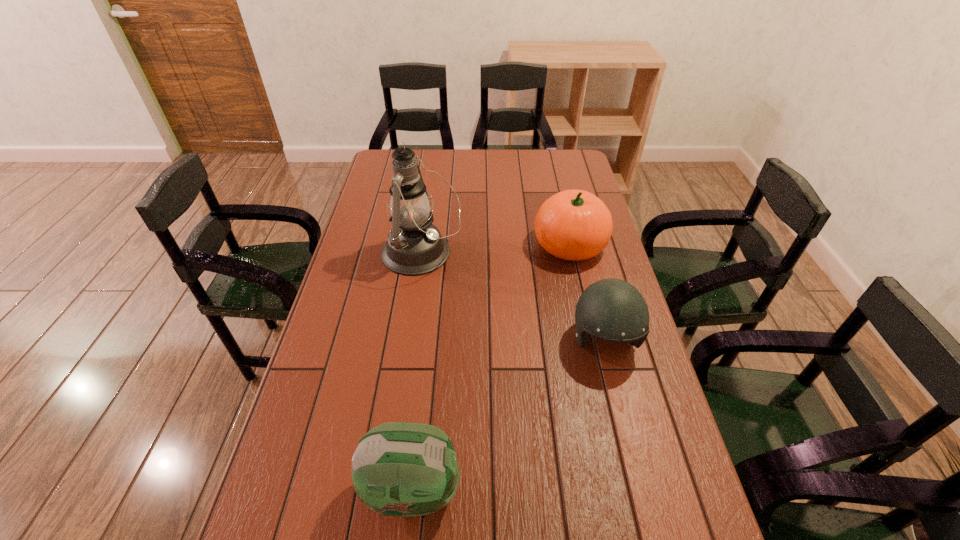
Locate an element on the screen. object that is at the left edge is located at coordinates (414, 246).

Locate an element on the screen. The image size is (960, 540). pumpkin located in the right edge section of the desktop is located at coordinates (573, 224).

You are a GUI agent. You are given a task and a screenshot of the screen. Output one action in this format:
    pyautogui.click(x=<x>, y=<y>)
    Task: Click on the football helmet that is at the right edge
    Image resolution: width=960 pixels, height=540 pixels.
    Given the screenshot: What is the action you would take?
    pyautogui.click(x=613, y=310)

This screenshot has width=960, height=540. In the image, there is a desktop. What are the coordinates of `vacant space at the far edge` in the screenshot? It's located at (489, 167).

The width and height of the screenshot is (960, 540). Find the location of `vacant region at the left edge`. vacant region at the left edge is located at coordinates (327, 472).

In the image, there is a desktop. At what (x,y) coordinates should I click in order to perform the action: click on free space at the right edge. Please return your answer as a coordinate pair (x, y). The image size is (960, 540). Looking at the image, I should click on (616, 415).

At what (x,y) coordinates should I click in order to perform the action: click on free space between the right football helmet and the oil lamp. Please return your answer as a coordinate pair (x, y). The image size is (960, 540). Looking at the image, I should click on (513, 297).

Image resolution: width=960 pixels, height=540 pixels. I want to click on vacant area that lies between the right football helmet and the left football helmet, so click(x=509, y=415).

The height and width of the screenshot is (540, 960). What are the coordinates of `free point between the pumpkin and the nearest object` in the screenshot? It's located at (492, 367).

The width and height of the screenshot is (960, 540). What are the coordinates of `vacant area that lies between the farther football helmet and the left football helmet` in the screenshot? It's located at (509, 415).